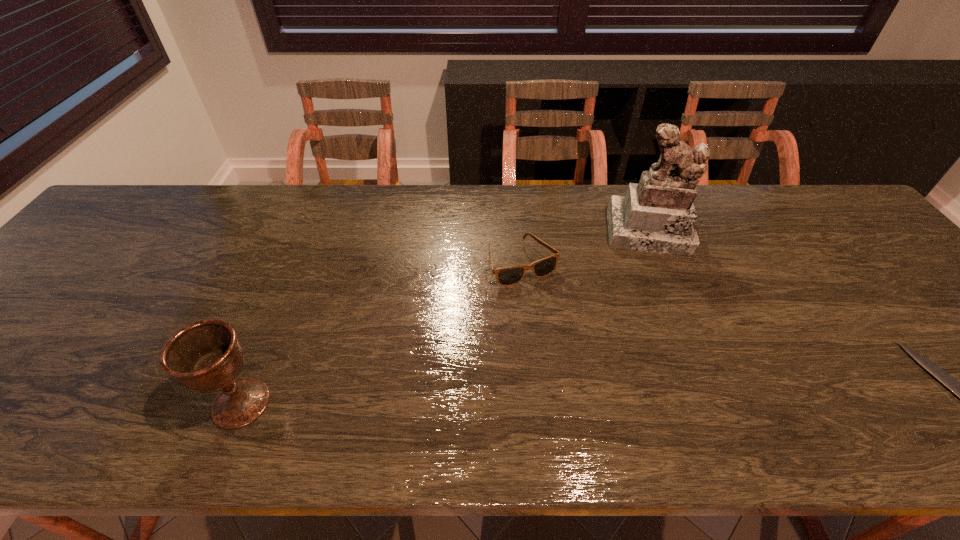
At what (x,y) coordinates should I click in order to perform the action: click on vacant spot on the desktop that is between the leftmost object and the rightmost object and is positioned on the frames of the third tallest object. Please return your answer as a coordinate pair (x, y). Image resolution: width=960 pixels, height=540 pixels. Looking at the image, I should click on (608, 401).

I want to click on vacant space on the desktop that is between the third shortest object and the shortest object and is positioned on the front-facing side of the figurine, so click(x=671, y=400).